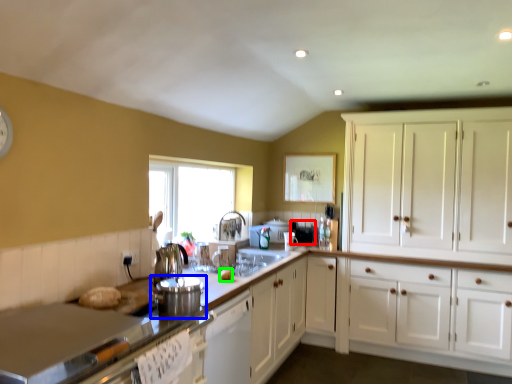
Question: Based on their relative distances, which object is nearer to appliance (highlighted by a red box)? Choose from appliance (highlighted by a blue box) and food (highlighted by a green box).

Choices:
 (A) appliance
 (B) food

Answer: (B)